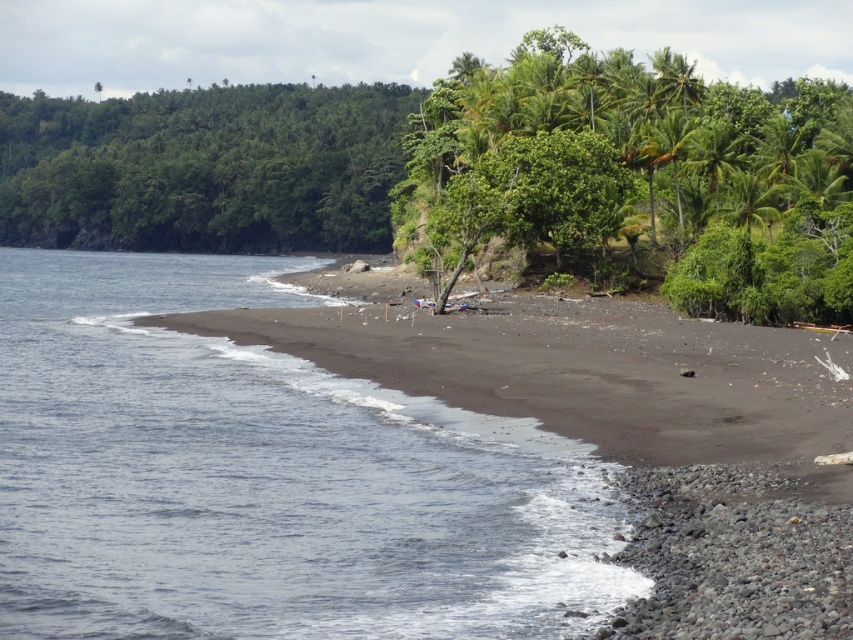
You are standing on the beach and notice the dark blue water at lower left and the green leafy trees at upper left. Which object is closer to the horizon?

The green leafy trees at upper left are closer to the horizon because they are positioned above the dark blue water at lower left, which is lower in the image and thus farther from the horizon.

You are standing on the beach looking towards the sea. You see the dark blue water at lower left and the green leafy trees at upper right. Which object is closer to the horizon?

The dark blue water at lower left is closer to the horizon because it is positioned below the green leafy trees at upper right, placing it further away from the viewer and thus nearer to the horizon.